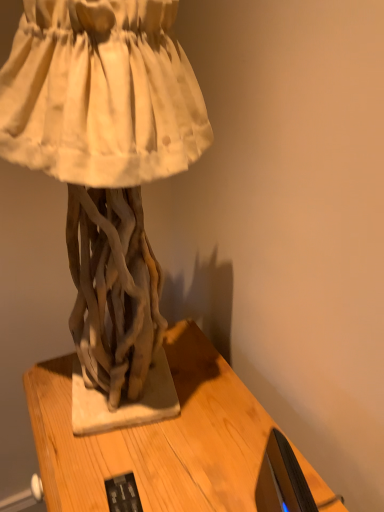
This screenshot has height=512, width=384. I want to click on black glossy monitor at lower right, so click(x=282, y=479).

This screenshot has width=384, height=512. Describe the element at coordinates (105, 158) in the screenshot. I see `matte driftwood sculpture at center` at that location.

Find the location of `matte driftwood sculpture at center`. matte driftwood sculpture at center is located at coordinates 105,158.

Locate an element on the screen. Image resolution: width=384 pixels, height=512 pixels. black glossy monitor at lower right is located at coordinates (282, 479).

Is matte driftwood sculpture at center smaller than black glossy monitor at lower right?

Actually, matte driftwood sculpture at center might be larger than black glossy monitor at lower right.

The height and width of the screenshot is (512, 384). I want to click on sculpture above the black glossy monitor at lower right (from the image's perspective), so click(105, 158).

Which object is thinner, matte driftwood sculpture at center or black glossy monitor at lower right?

black glossy monitor at lower right is thinner.

From a real-world perspective, between matte driftwood sculpture at center and black glossy monitor at lower right, who is vertically higher?

From a 3D spatial view, matte driftwood sculpture at center is above.

From the image's perspective, relative to black glossy monitor at lower right, is wooden table at center above or below?

Clearly, from the image's perspective, wooden table at center is below black glossy monitor at lower right.

Which object is positioned more to the left, wooden table at center or black glossy monitor at lower right?

From the viewer's perspective, wooden table at center appears more on the left side.

Considering the positions of points (198, 402) and (283, 469), is point (198, 402) closer to camera compared to point (283, 469)?

No, it is behind (283, 469).

Does wooden table at center have a lesser width compared to black glossy monitor at lower right?

No.

From a real-world perspective, is matte driftwood sculpture at center physically above wooden table at center?

Yes, from a real-world perspective, matte driftwood sculpture at center is above wooden table at center.

Is wooden table at center at the back of matte driftwood sculpture at center?

No, matte driftwood sculpture at center is not facing away from wooden table at center.

From the image's perspective, is matte driftwood sculpture at center on wooden table at center?

Yes, from the image's perspective, matte driftwood sculpture at center is on top of wooden table at center.

Considering the sizes of objects matte driftwood sculpture at center and wooden table at center in the image provided, who is wider, matte driftwood sculpture at center or wooden table at center?

wooden table at center is wider.

From the image's perspective, is black glossy monitor at lower right above or below matte driftwood sculpture at center?

black glossy monitor at lower right is below matte driftwood sculpture at center.

Can you confirm if black glossy monitor at lower right is shorter than matte driftwood sculpture at center?

Correct, black glossy monitor at lower right is not as tall as matte driftwood sculpture at center.

Considering the relative sizes of black glossy monitor at lower right and matte driftwood sculpture at center in the image provided, is black glossy monitor at lower right smaller than matte driftwood sculpture at center?

Correct, black glossy monitor at lower right occupies less space than matte driftwood sculpture at center.

Image resolution: width=384 pixels, height=512 pixels. In the image, there is a wooden table at center. Identify the location of sculpture above it (from the image's perspective). (105, 158).

Between wooden table at center and matte driftwood sculpture at center, which one has less height?

matte driftwood sculpture at center.

Considering the points (218, 505) and (139, 233), which point is in front, point (218, 505) or point (139, 233)?

The point (218, 505) is in front.

Is black glossy monitor at lower right closer to the viewer compared to wooden table at center?

Yes.

Between point (260, 482) and point (189, 394), which one is positioned in front?

The point (260, 482) is in front.

Is black glossy monitor at lower right to the left of wooden table at center from the viewer's perspective?

No.

Could you tell me if black glossy monitor at lower right is turned towards wooden table at center?

No, black glossy monitor at lower right is not aimed at wooden table at center.

The image size is (384, 512). Find the location of `sculpture lying in front of the black glossy monitor at lower right`. sculpture lying in front of the black glossy monitor at lower right is located at coordinates (105, 158).

The height and width of the screenshot is (512, 384). In order to click on table located on the left of black glossy monitor at lower right in this screenshot , I will do `click(155, 437)`.

Consider the image. Looking at the image, which one is located further to wooden table at center, black glossy monitor at lower right or matte driftwood sculpture at center?

matte driftwood sculpture at center lies further to wooden table at center than the other object.

Looking at this image, based on their spatial positions, is matte driftwood sculpture at center or black glossy monitor at lower right closer to wooden table at center?

black glossy monitor at lower right is positioned closer to the anchor wooden table at center.

Looking at the image, which one is located further to black glossy monitor at lower right, matte driftwood sculpture at center or wooden table at center?

The object further to black glossy monitor at lower right is matte driftwood sculpture at center.

Looking at this image, based on their spatial positions, is wooden table at center or matte driftwood sculpture at center further from black glossy monitor at lower right?

matte driftwood sculpture at center lies further to black glossy monitor at lower right than the other object.

Considering their positions, is black glossy monitor at lower right positioned further to matte driftwood sculpture at center than wooden table at center?

black glossy monitor at lower right is positioned further to the anchor matte driftwood sculpture at center.

Looking at the image, which one is located further to matte driftwood sculpture at center, wooden table at center or black glossy monitor at lower right?

black glossy monitor at lower right is further to matte driftwood sculpture at center.

Find the location of `computer monitor that lies between matte driftwood sculpture at center and wooden table at center from top to bottom`. computer monitor that lies between matte driftwood sculpture at center and wooden table at center from top to bottom is located at coordinates (282, 479).